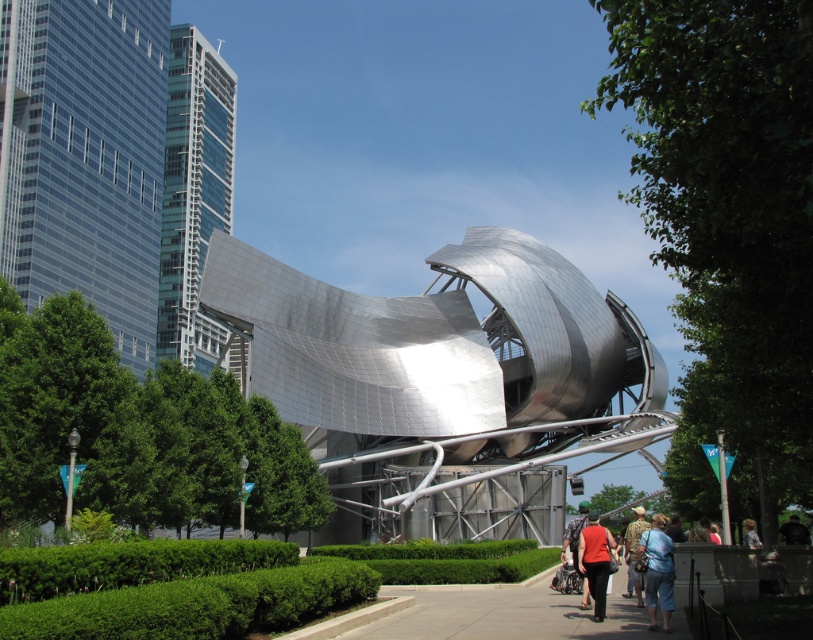
Question: Considering the real-world distances, which object is closest to the glassy steel skyscraper at upper left?

Choices:
 (A) matte orange tank top at center
 (B) black leather jacket at lower right

Answer: (A)

Question: Is matte orange tank top at center to the left of black leather jacket at lower right from the viewer's perspective?

Choices:
 (A) yes
 (B) no

Answer: (A)

Question: Which point is farther to the camera?

Choices:
 (A) blue denim jeans at lower right
 (B) camouflage fabric shirt at center
 (C) glassy steel skyscraper at upper left
 (D) glassy reflective skyscraper at upper left

Answer: (C)

Question: Is glassy reflective skyscraper at upper left wider than black leather jacket at lower right?

Choices:
 (A) yes
 (B) no

Answer: (A)

Question: Does blue denim jeans at lower right appear on the left side of black leather jacket at lower right?

Choices:
 (A) no
 (B) yes

Answer: (B)

Question: Which of the following is the farthest from the observer?

Choices:
 (A) (159, 340)
 (B) (607, 538)
 (C) (638, 596)

Answer: (A)